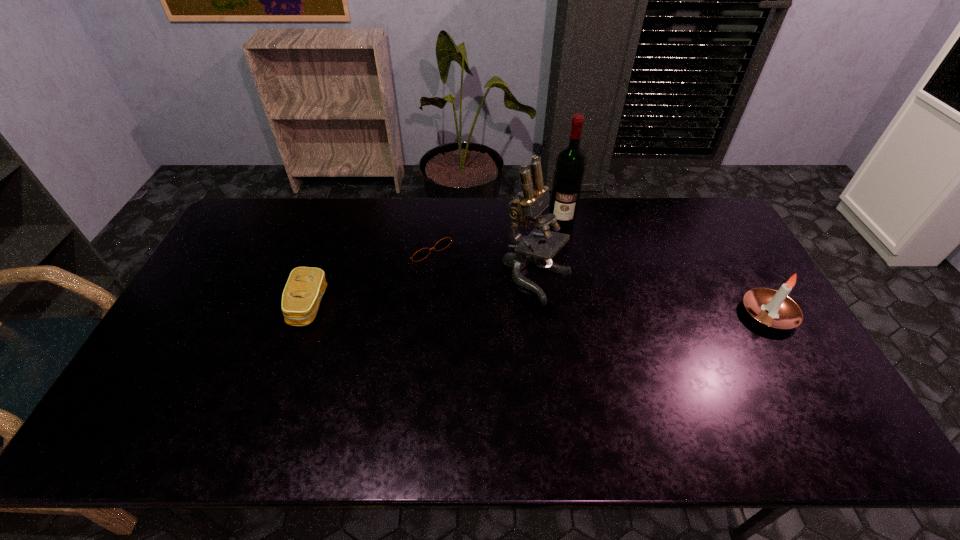
At what (x,y) coordinates should I click in order to perform the action: click on free spot on the desktop that is between the clutch bag and the candle and is positioned on the face of the shortest object. Please return your answer as a coordinate pair (x, y). The width and height of the screenshot is (960, 540). Looking at the image, I should click on coord(489,309).

Where is `vacant spot on the desktop that is between the leftmost object and the rightmost object and is positioned on the front and back of the alcohol`? Image resolution: width=960 pixels, height=540 pixels. vacant spot on the desktop that is between the leftmost object and the rightmost object and is positioned on the front and back of the alcohol is located at coordinates (560, 310).

The image size is (960, 540). I want to click on vacant space on the desktop that is between the leftmost object and the rightmost object and is positioned at the eyepieces of the microscope, so click(601, 311).